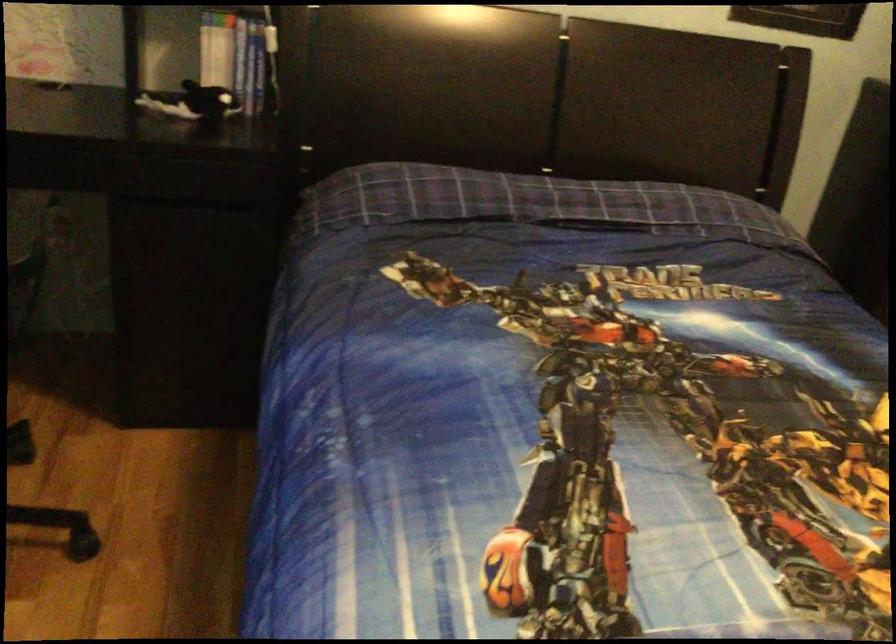
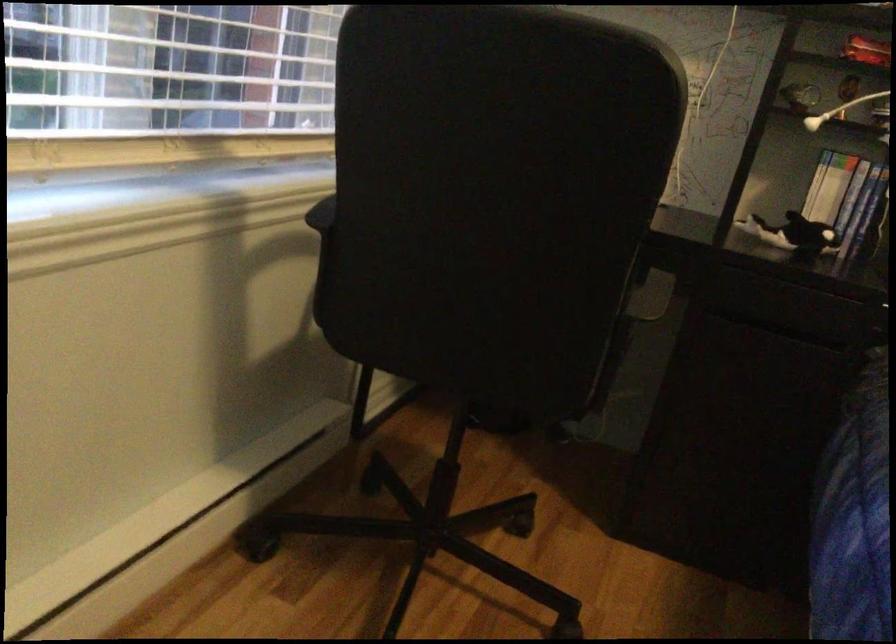
Locate, in the second image, the point that corresponds to [280,366] in the first image.

(853, 518)